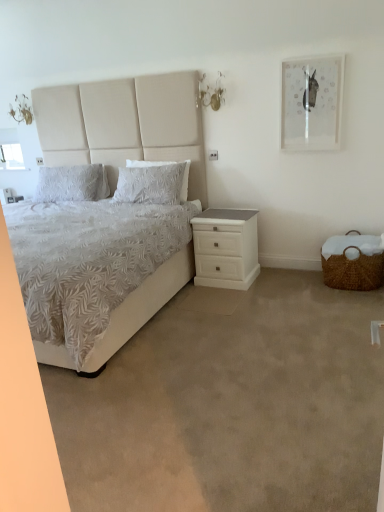
What is the approximate width of white textured pillow at upper left, which is the second pillow in right-to-left order?

white textured pillow at upper left, which is the second pillow in right-to-left order, is 10.45 inches wide.

Find the location of `beige carpet at lower center`. beige carpet at lower center is located at coordinates (231, 405).

Identify the location of white matte nightstand at lower right. The width and height of the screenshot is (384, 512). (226, 248).

You are a GUI agent. You are given a task and a screenshot of the screen. Output one action in this format:
    pyautogui.click(x=<x>, y=<y>)
    Task: Click on the woven brown basket at lower right
    
    Given the screenshot: What is the action you would take?
    tap(353, 262)

This screenshot has width=384, height=512. Describe the element at coordinates (153, 183) in the screenshot. I see `white textured pillow at center, placed as the first pillow when sorted from right to left` at that location.

The width and height of the screenshot is (384, 512). I want to click on white textured pillow at upper left, which is the second pillow in right-to-left order, so click(x=72, y=183).

Which is behind, point (281, 368) or point (240, 256)?

Positioned behind is point (240, 256).

Is beige carpet at lower center not within white matte nightstand at lower right?

Yes, beige carpet at lower center is not within white matte nightstand at lower right.

Considering the relative sizes of beige carpet at lower center and white matte nightstand at lower right in the image provided, is beige carpet at lower center thinner than white matte nightstand at lower right?

Incorrect, the width of beige carpet at lower center is not less than that of white matte nightstand at lower right.

Does beige carpet at lower center touch white matte nightstand at lower right?

beige carpet at lower center is not next to white matte nightstand at lower right, and they're not touching.

Is point (115, 192) in front of point (357, 270)?

No, it is not.

From a real-world perspective, does white textured pillow at center, the second pillow when ordered from left to right, sit lower than woven brown basket at lower right?

No, from a real-world perspective, white textured pillow at center, the second pillow when ordered from left to right, is not beneath woven brown basket at lower right.

Is white textured pillow at center, placed as the first pillow when sorted from right to left, facing away from woven brown basket at lower right?

No, woven brown basket at lower right is not at the back of white textured pillow at center, placed as the first pillow when sorted from right to left.

Considering the relative sizes of woven brown basket at lower right and beige carpet at lower center in the image provided, is woven brown basket at lower right wider than beige carpet at lower center?

In fact, woven brown basket at lower right might be narrower than beige carpet at lower center.

Who is smaller, woven brown basket at lower right or beige carpet at lower center?

Smaller between the two is woven brown basket at lower right.

Who is shorter, woven brown basket at lower right or beige carpet at lower center?

With less height is beige carpet at lower center.

Is white textured pillow at center, the second pillow when ordered from left to right, oriented away from matte white picture frame at upper right?

No.

Is white textured pillow at center, placed as the first pillow when sorted from right to left, situated inside matte white picture frame at upper right or outside?

white textured pillow at center, placed as the first pillow when sorted from right to left, exists outside the volume of matte white picture frame at upper right.

From the image's perspective, is white textured pillow at center, placed as the first pillow when sorted from right to left, below matte white picture frame at upper right?

Yes.

Which of these two, white textured pillow at center, the second pillow when ordered from left to right, or matte white picture frame at upper right, stands taller?

With more height is matte white picture frame at upper right.

Is beige carpet at lower center turned away from white textured pillow at upper left, the 1th pillow positioned from the left?

beige carpet at lower center is not turned away from white textured pillow at upper left, the 1th pillow positioned from the left.

At what (x,y) coordinates should I click in order to perform the action: click on plain in front of the white textured pillow at upper left, the 1th pillow positioned from the left. Please return your answer as a coordinate pair (x, y). The width and height of the screenshot is (384, 512). Looking at the image, I should click on (231, 405).

Would you consider beige carpet at lower center to be distant from white textured pillow at upper left, which is the second pillow in right-to-left order?

Yes, beige carpet at lower center and white textured pillow at upper left, which is the second pillow in right-to-left order, are quite far apart.

From a real-world perspective, which object stands above the other?

In real-world perspective, white textured pillow at upper left, which is the second pillow in right-to-left order, is above.

From a real-world perspective, who is located lower, white textured pillow at center, the second pillow when ordered from left to right, or white textured pillow at upper left, the 1th pillow positioned from the left?

From a 3D spatial view, white textured pillow at center, the second pillow when ordered from left to right, is below.

Image resolution: width=384 pixels, height=512 pixels. I want to click on pillow lying on the left of white textured pillow at center, the second pillow when ordered from left to right, so click(x=72, y=183).

Between white textured pillow at center, placed as the first pillow when sorted from right to left, and white textured pillow at upper left, the 1th pillow positioned from the left, which one has less height?

Standing shorter between the two is white textured pillow at upper left, the 1th pillow positioned from the left.

How different are the orientations of white textured pillow at center, placed as the first pillow when sorted from right to left, and white textured pillow at upper left, which is the second pillow in right-to-left order, in degrees?

There is a 0.00397-degree angle between the facing directions of white textured pillow at center, placed as the first pillow when sorted from right to left, and white textured pillow at upper left, which is the second pillow in right-to-left order.

The height and width of the screenshot is (512, 384). In order to click on basket on the right of matte white picture frame at upper right in this screenshot , I will do `click(353, 262)`.

Between matte white picture frame at upper right and woven brown basket at lower right, which one appears on the left side from the viewer's perspective?

matte white picture frame at upper right.

Considering the sizes of objects matte white picture frame at upper right and woven brown basket at lower right in the image provided, who is taller, matte white picture frame at upper right or woven brown basket at lower right?

With more height is matte white picture frame at upper right.

Can you confirm if matte white picture frame at upper right is thinner than woven brown basket at lower right?

Indeed, matte white picture frame at upper right has a lesser width compared to woven brown basket at lower right.

Find the location of a particular element. The height and width of the screenshot is (512, 384). plain beneath the white matte nightstand at lower right (from a real-world perspective) is located at coordinates (231, 405).

At what (x,y) coordinates should I click in order to perform the action: click on basket on the right of white textured pillow at center, the second pillow when ordered from left to right. Please return your answer as a coordinate pair (x, y). The image size is (384, 512). Looking at the image, I should click on (353, 262).

Looking at the image, which one is located closer to white textured pillow at center, the second pillow when ordered from left to right, white textured pillow at upper left, which is the second pillow in right-to-left order, or matte white picture frame at upper right?

Among the two, white textured pillow at upper left, which is the second pillow in right-to-left order, is located nearer to white textured pillow at center, the second pillow when ordered from left to right.

From the image, which object appears to be farther from beige carpet at lower center, white matte nightstand at lower right or white textured pillow at center, the second pillow when ordered from left to right?

white textured pillow at center, the second pillow when ordered from left to right, is positioned further to the anchor beige carpet at lower center.

Based on their spatial positions, is white textured pillow at center, the second pillow when ordered from left to right, or white fabric bed at left further from beige carpet at lower center?

white fabric bed at left lies further to beige carpet at lower center than the other object.

When comparing their distances from woven brown basket at lower right, does matte white picture frame at upper right or white fabric bed at left seem further?

white fabric bed at left lies further to woven brown basket at lower right than the other object.

Which object lies further to the anchor point white fabric bed at left, white textured pillow at center, the second pillow when ordered from left to right, or white matte nightstand at lower right?

white matte nightstand at lower right is positioned further to the anchor white fabric bed at left.

Looking at the image, which one is located further to woven brown basket at lower right, white fabric bed at left or beige carpet at lower center?

white fabric bed at left is positioned further to the anchor woven brown basket at lower right.

When comparing their distances from white fabric bed at left, does woven brown basket at lower right or white textured pillow at center, the second pillow when ordered from left to right, seem further?

woven brown basket at lower right is positioned further to the anchor white fabric bed at left.

When comparing their distances from white fabric bed at left, does matte white picture frame at upper right or white textured pillow at upper left, which is the second pillow in right-to-left order, seem further?

Based on the image, matte white picture frame at upper right appears to be further to white fabric bed at left.

In order to click on picture frame between beige carpet at lower center and white matte nightstand at lower right along the z-axis in this screenshot , I will do `click(311, 103)`.

Locate an element on the screen. nightstand between white fabric bed at left and matte white picture frame at upper right from left to right is located at coordinates (226, 248).

Identify the location of basket between beige carpet at lower center and white textured pillow at center, the second pillow when ordered from left to right, in the front-back direction. The image size is (384, 512). (353, 262).

You are a GUI agent. You are given a task and a screenshot of the screen. Output one action in this format:
    pyautogui.click(x=<x>, y=<y>)
    Task: Click on the pillow situated between white fabric bed at left and matte white picture frame at upper right from left to right
    
    Given the screenshot: What is the action you would take?
    pyautogui.click(x=153, y=183)